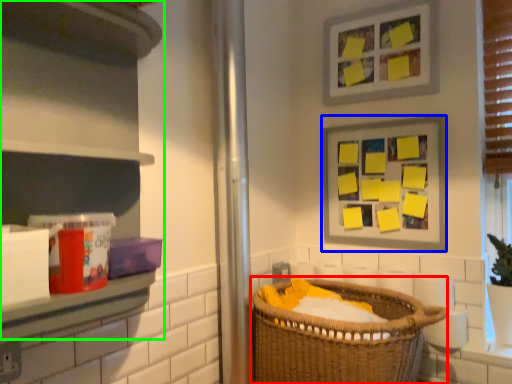
Question: Considering the real-world distances, which object is closest to basket (highlighted by a red box)? picture frame (highlighted by a blue box) or cabinet (highlighted by a green box).

Choices:
 (A) picture frame
 (B) cabinet

Answer: (A)